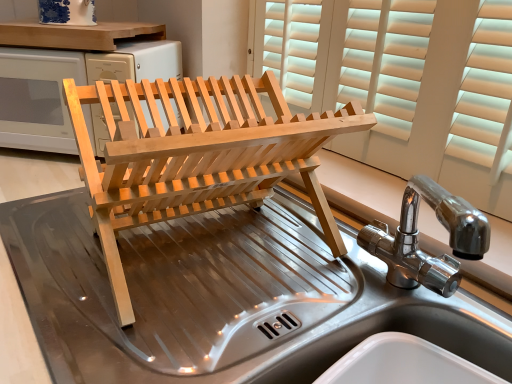
Question: Considering the positions of natural wood dish rack at center and stainless steel sink at center, the second sink from the top, in the image, is natural wood dish rack at center wider or thinner than stainless steel sink at center, the second sink from the top,?

Choices:
 (A) thin
 (B) wide

Answer: (A)

Question: In terms of size, does natural wood dish rack at center appear bigger or smaller than stainless steel sink at center, which ranks as the first sink in bottom-to-top order?

Choices:
 (A) big
 (B) small

Answer: (B)

Question: Which is farther from the stainless steel sink at center, the second sink from the top?

Choices:
 (A) polished stainless steel sink at center, placed as the 1th sink when sorted from top to bottom
 (B) natural wood dish rack at center

Answer: (A)

Question: Estimate the real-world distances between objects in this image. Which object is farther from the polished stainless steel sink at center, placed as the 1th sink when sorted from top to bottom?

Choices:
 (A) natural wood dish rack at center
 (B) stainless steel sink at center, the second sink from the top

Answer: (B)